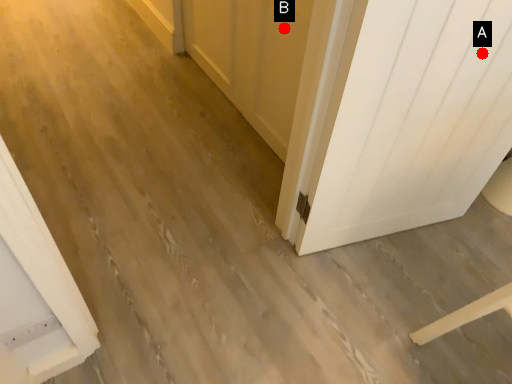
Question: Two points are circled on the image, labeled by A and B beside each circle. Which point appears closest to the camera in this image?

Choices:
 (A) A is closer
 (B) B is closer

Answer: (A)